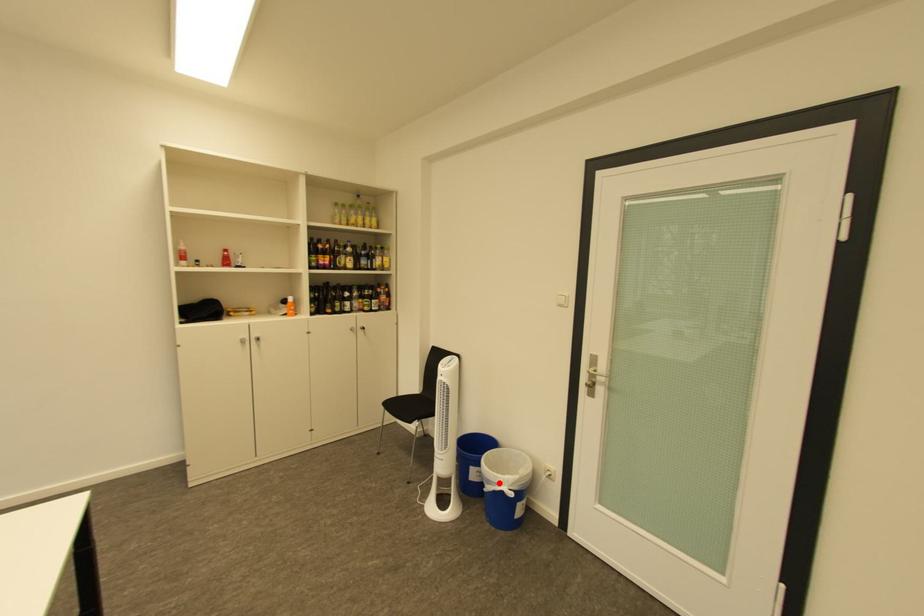
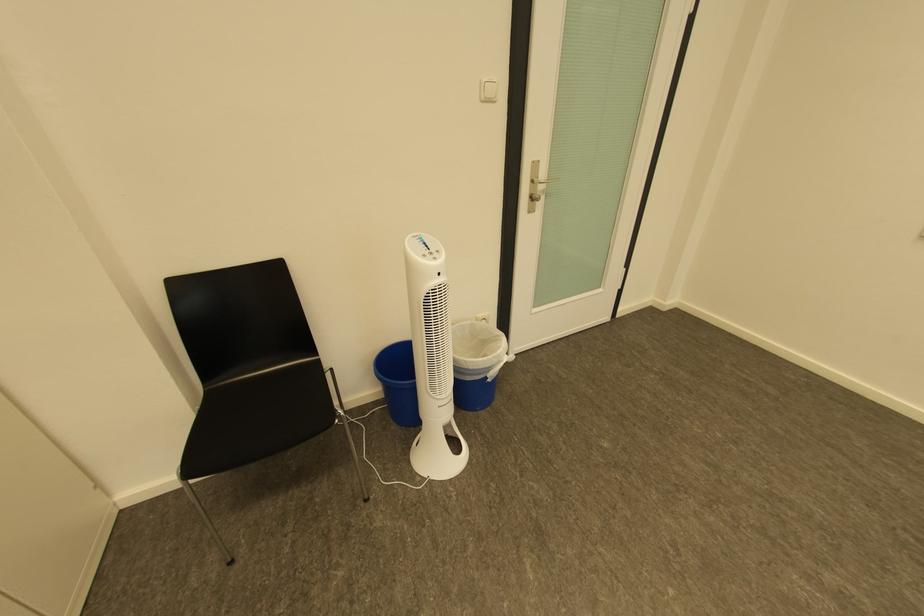
Where in the second image is the point corresponding to the highlighted location from the first image?

(499, 370)